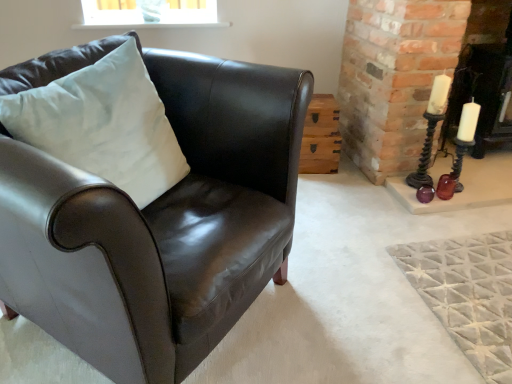
Image resolution: width=512 pixels, height=384 pixels. I want to click on metallic dark brown candle holder at right, so click(431, 130).

What is the approximate height of white satin pillow at left?

white satin pillow at left is 19.83 inches in height.

What do you see at coordinates (483, 71) in the screenshot? I see `white glossy fireplace at right` at bounding box center [483, 71].

Where is `wooden crate at center-right`? wooden crate at center-right is located at coordinates (321, 137).

Could you tell me if white satin pillow at left is turned towards metallic dark brown candle holder at right?

No, white satin pillow at left is not aimed at metallic dark brown candle holder at right.

Who is shorter, white satin pillow at left or metallic dark brown candle holder at right?

white satin pillow at left is shorter.

Which object is positioned more to the left, white satin pillow at left or metallic dark brown candle holder at right?

white satin pillow at left is more to the left.

From a real-world perspective, is white satin pillow at left on top of metallic dark brown candle holder at right?

Correct, in the physical world, white satin pillow at left is higher than metallic dark brown candle holder at right.

Is metallic dark brown candle holder at right located within white glossy fireplace at right?

No, metallic dark brown candle holder at right is not inside white glossy fireplace at right.

Measure the distance from white glossy fireplace at right to metallic dark brown candle holder at right.

A distance of 19.54 inches exists between white glossy fireplace at right and metallic dark brown candle holder at right.

Is white glossy fireplace at right smaller than metallic dark brown candle holder at right?

No.

Looking at this image, which object is positioned more to the left, white glossy fireplace at right or metallic dark brown candle holder at right?

From the viewer's perspective, metallic dark brown candle holder at right appears more on the left side.

Does point (73, 268) lie behind point (336, 130)?

No, (73, 268) is closer to viewer.

Between shiny brown leather armchair at left and wooden crate at center-right, which one has larger size?

Bigger between the two is shiny brown leather armchair at left.

Considering the sizes of shiny brown leather armchair at left and wooden crate at center-right in the image, is shiny brown leather armchair at left wider or thinner than wooden crate at center-right?

In the image, shiny brown leather armchair at left appears to be wider than wooden crate at center-right.

Is shiny brown leather armchair at left not inside wooden crate at center-right?

shiny brown leather armchair at left is positioned outside wooden crate at center-right.

Can you confirm if white glossy fireplace at right is taller than white satin pillow at left?

Correct, white glossy fireplace at right is much taller as white satin pillow at left.

Is white glossy fireplace at right inside or outside of white satin pillow at left?

white glossy fireplace at right is outside white satin pillow at left.

Which point is more distant from viewer, (474, 15) or (137, 159)?

The point (474, 15) is farther from the camera.

From a real-world perspective, is shiny brown leather armchair at left physically above white glossy fireplace at right?

Actually, shiny brown leather armchair at left is physically below white glossy fireplace at right in the real world.

Could you tell me if shiny brown leather armchair at left is facing white glossy fireplace at right?

No, shiny brown leather armchair at left is not aimed at white glossy fireplace at right.

Which is nearer, (x=240, y=300) or (x=509, y=36)?

Point (x=240, y=300).

Can you confirm if shiny brown leather armchair at left is positioned to the left of white glossy fireplace at right?

Correct, you'll find shiny brown leather armchair at left to the left of white glossy fireplace at right.

Is metallic dark brown candle holder at right in front of or behind wooden crate at center-right in the image?

Clearly, metallic dark brown candle holder at right is in front of wooden crate at center-right.

Find the location of a particular element. The image size is (512, 384). table to the left of metallic dark brown candle holder at right is located at coordinates (321, 137).

Is metallic dark brown candle holder at right spatially inside wooden crate at center-right, or outside of it?

metallic dark brown candle holder at right cannot be found inside wooden crate at center-right.

From a real-world perspective, does white satin pillow at left stand above white glossy fireplace at right?

Indeed, from a real-world perspective, white satin pillow at left stands above white glossy fireplace at right.

Is the surface of white satin pillow at left in direct contact with white glossy fireplace at right?

There is a gap between white satin pillow at left and white glossy fireplace at right.

In the image, is white satin pillow at left on the left side or the right side of white glossy fireplace at right?

Based on their positions, white satin pillow at left is located to the left of white glossy fireplace at right.

Is white satin pillow at left turned away from white glossy fireplace at right?

No, white satin pillow at left's orientation is not away from white glossy fireplace at right.

Find the location of a particular element. This screenshot has height=384, width=512. candle holder on the right of the white satin pillow at left is located at coordinates (431, 130).

The width and height of the screenshot is (512, 384). In order to click on candle holder on the left of the white glossy fireplace at right in this screenshot , I will do `click(431, 130)`.

When comparing their distances from white glossy fireplace at right, does metallic dark brown candle holder at right or white satin pillow at left seem further?

white satin pillow at left.

Consider the image. From the image, which object appears to be farther from metallic dark brown candle holder at right, shiny brown leather armchair at left or wooden crate at center-right?

Based on the image, shiny brown leather armchair at left appears to be further to metallic dark brown candle holder at right.

Considering their positions, is metallic dark brown candle holder at right positioned further to wooden crate at center-right than white glossy fireplace at right?

The object further to wooden crate at center-right is white glossy fireplace at right.

Based on their spatial positions, is white glossy fireplace at right or wooden crate at center-right further from white satin pillow at left?

white glossy fireplace at right lies further to white satin pillow at left than the other object.

Considering their positions, is wooden crate at center-right positioned closer to shiny brown leather armchair at left than metallic dark brown candle holder at right?

wooden crate at center-right is positioned closer to the anchor shiny brown leather armchair at left.

Which object lies nearer to the anchor point white glossy fireplace at right, shiny brown leather armchair at left or metallic dark brown candle holder at right?

metallic dark brown candle holder at right is closer to white glossy fireplace at right.

Based on their spatial positions, is white satin pillow at left or metallic dark brown candle holder at right closer to wooden crate at center-right?

Among the two, metallic dark brown candle holder at right is located nearer to wooden crate at center-right.

Considering their positions, is shiny brown leather armchair at left positioned closer to wooden crate at center-right than metallic dark brown candle holder at right?

metallic dark brown candle holder at right is closer to wooden crate at center-right.

The width and height of the screenshot is (512, 384). What are the coordinates of `candle holder between wooden crate at center-right and white glossy fireplace at right` in the screenshot? It's located at coord(431,130).

Locate an element on the screen. This screenshot has width=512, height=384. candle holder positioned between white satin pillow at left and wooden crate at center-right from near to far is located at coordinates (431, 130).

I want to click on table between shiny brown leather armchair at left and white glossy fireplace at right in the horizontal direction, so click(x=321, y=137).

Identify the location of candle holder between white satin pillow at left and white glossy fireplace at right from left to right. (431, 130).